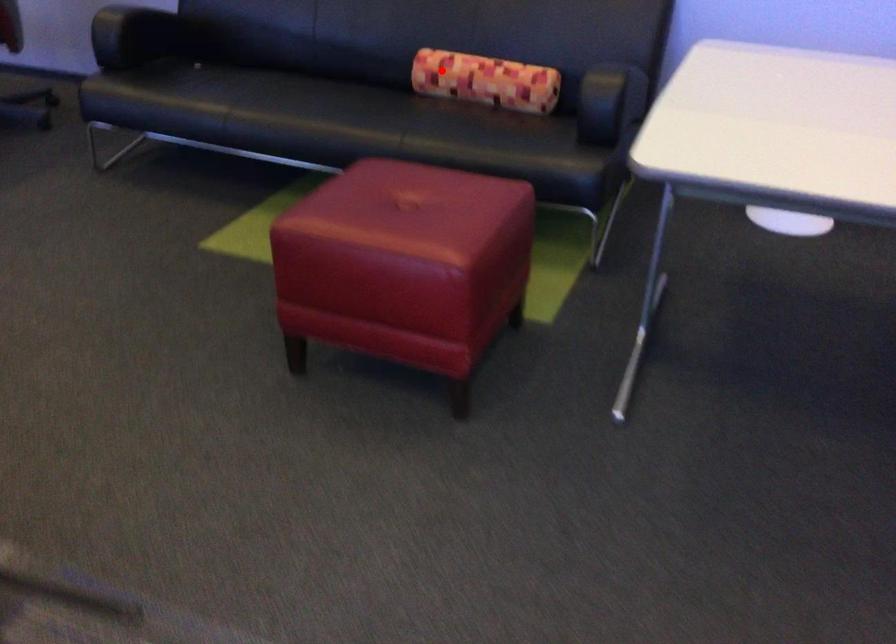
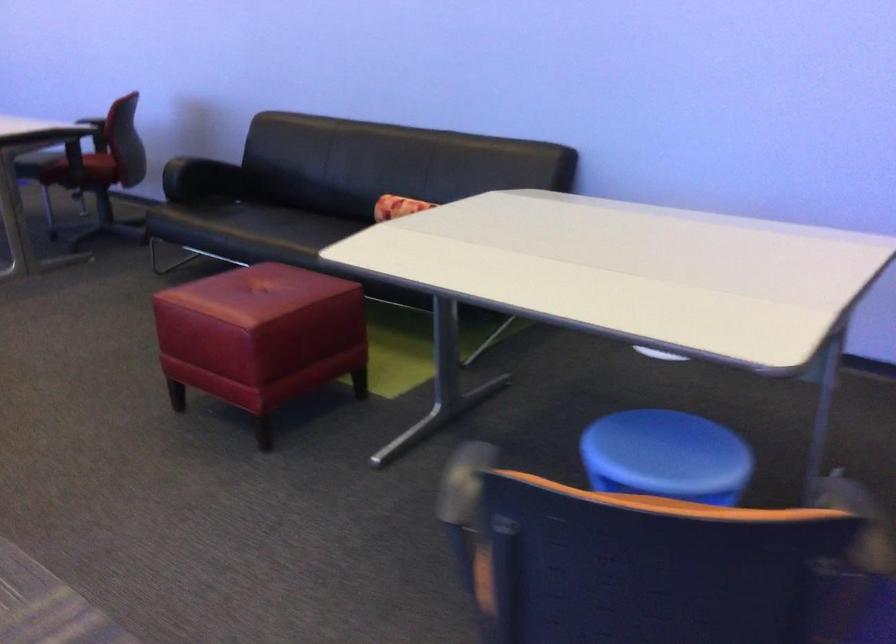
The point at the highlighted location is marked in the first image. Where is the corresponding point in the second image?

(398, 205)